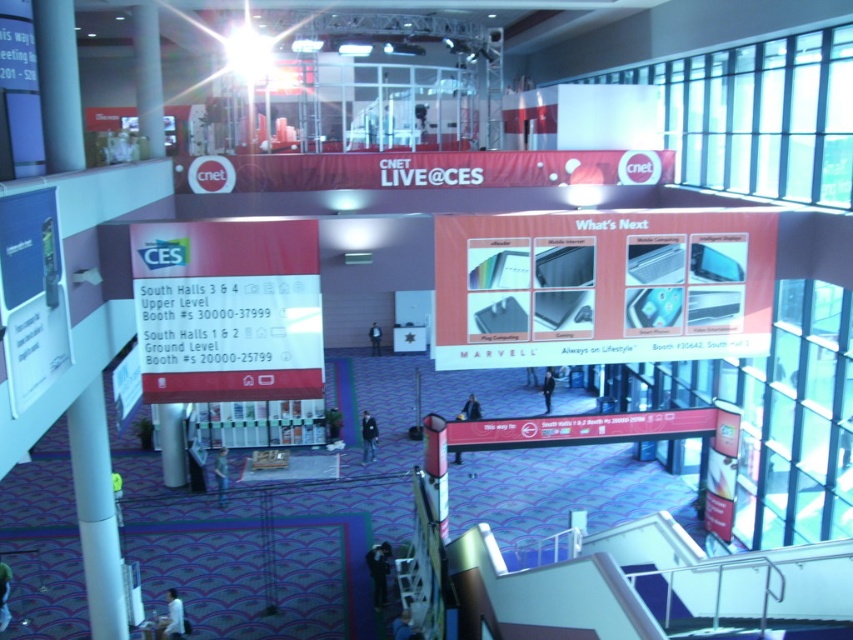
Question: Can you confirm if black fabric at lower center is positioned to the left of dark blue suit at center?

Choices:
 (A) yes
 (B) no

Answer: (A)

Question: Which point is farther to the camera?

Choices:
 (A) (401, 614)
 (B) (178, 596)
 (C) (375, 433)
 (D) (369, 330)

Answer: (D)

Question: Which point is closer to the camera?

Choices:
 (A) (x=700, y=291)
 (B) (x=479, y=404)
 (C) (x=374, y=445)

Answer: (A)

Question: Does dark blue shirt at center come behind dark blue fabric at center?

Choices:
 (A) yes
 (B) no

Answer: (B)

Question: Which object is the farthest from the dark blue jacket at center?

Choices:
 (A) dark blue shirt at center
 (B) black fabric at lower center

Answer: (B)

Question: Does orange matte sign at center appear on the left side of blue fabric jacket at lower center?

Choices:
 (A) yes
 (B) no

Answer: (B)